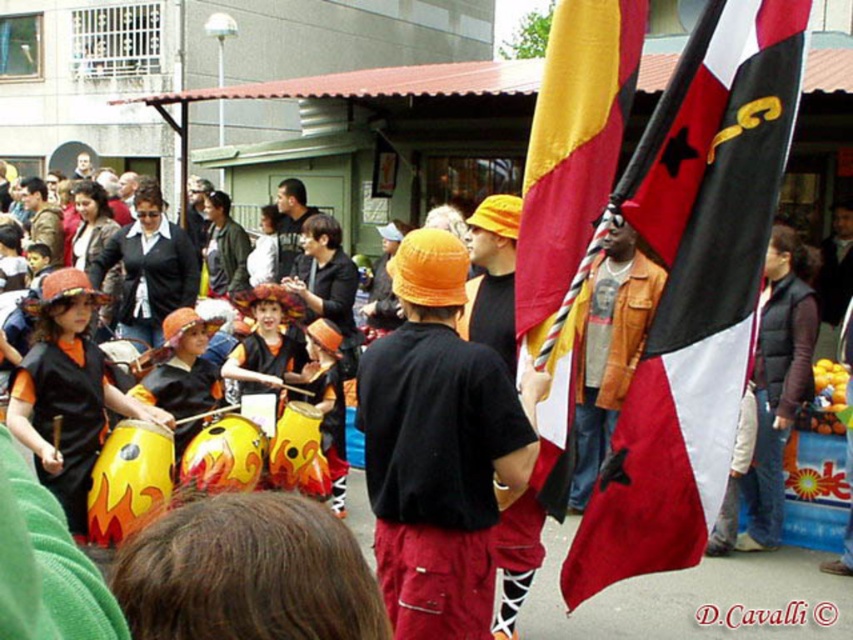
You are a photographer trying to capture the flag at the right side of the image. The scene has a point marked at coordinates (693, 289). Can you tell me where this point is located on the flag?

The point at coordinates (693, 289) is located on the red fabric flag at right.

You are a photographer standing at the center of the street. You want to take a photo of the red fabric flag at right. Where should you aim your camera to capture it?

You should aim your camera at point (693, 289) to capture the red fabric flag at right.